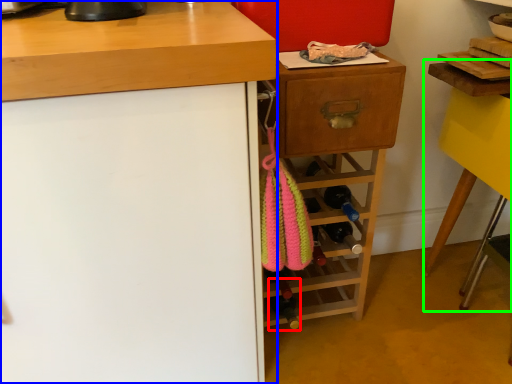
Question: Considering the real-world distances, which object is farthest from bottle (highlighted by a red box)? cabinetry (highlighted by a blue box) or computer desk (highlighted by a green box)?

Choices:
 (A) cabinetry
 (B) computer desk

Answer: (B)